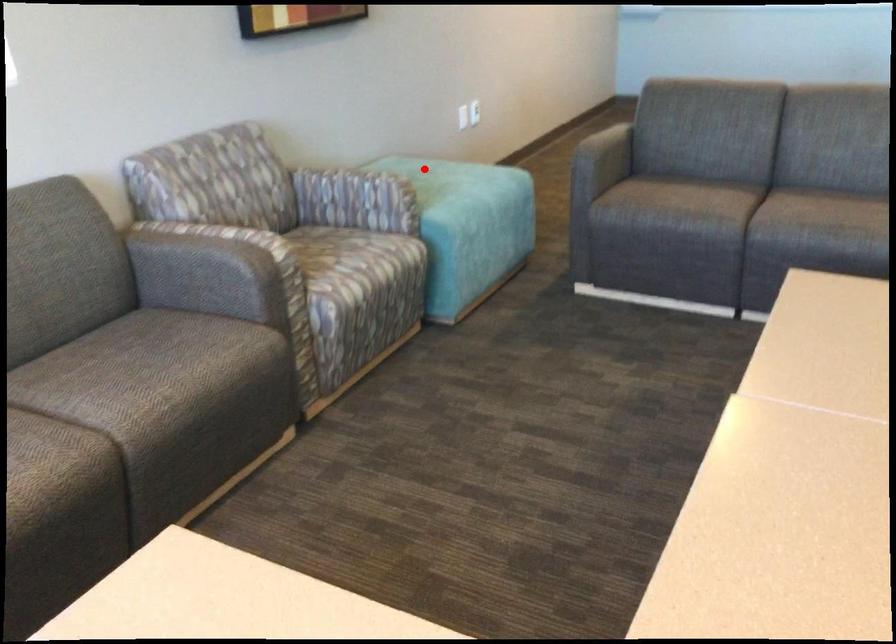
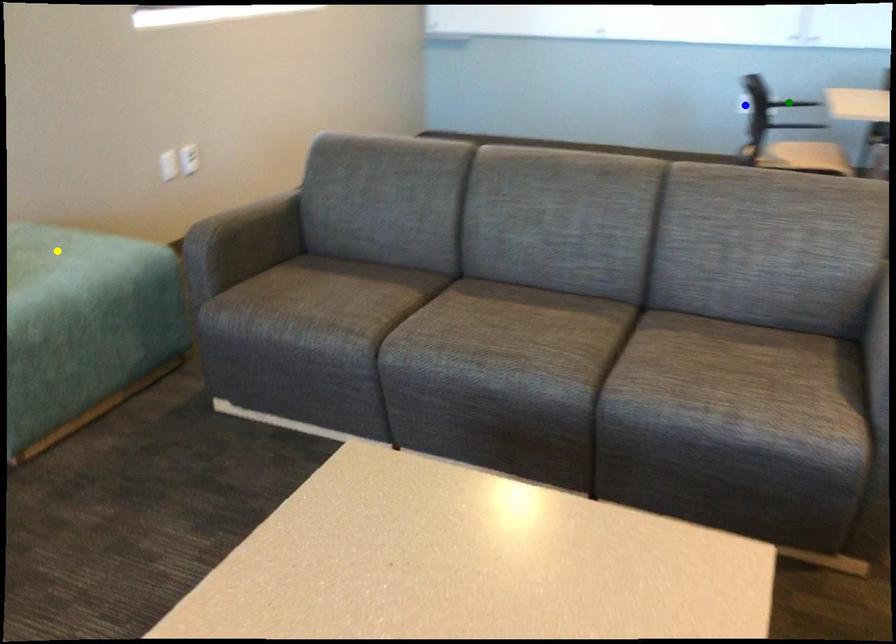
Question: I am providing you with two images of the same scene from different viewpoints. A red point is marked on the first image. You are given multiple points on the second image. Which spot in image 2 lines up with the point in image 1?

Choices:
 (A) blue point
 (B) yellow point
 (C) green point

Answer: (B)